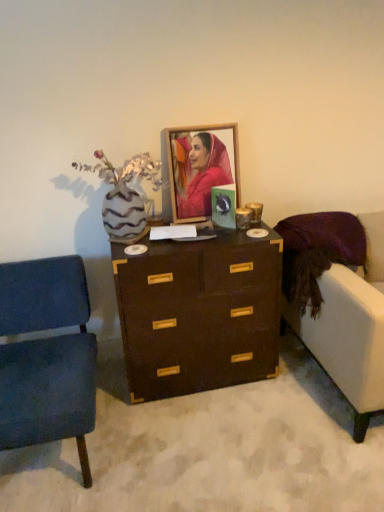
At what (x,y) coordinates should I click in order to perform the action: click on vacant area that is situated to the right of velvet blue chair at left. Please return your answer as a coordinate pair (x, y). The width and height of the screenshot is (384, 512). Looking at the image, I should click on (165, 444).